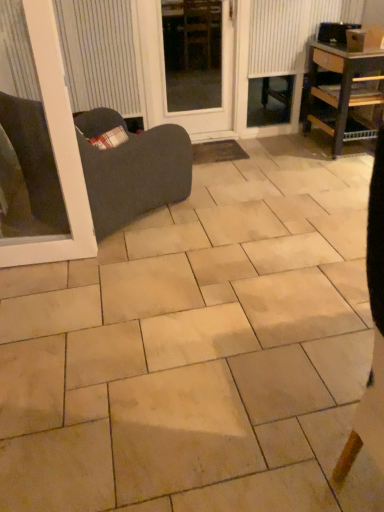
Identify the location of vacant region to the left of wooden shelf at right. The width and height of the screenshot is (384, 512). (285, 154).